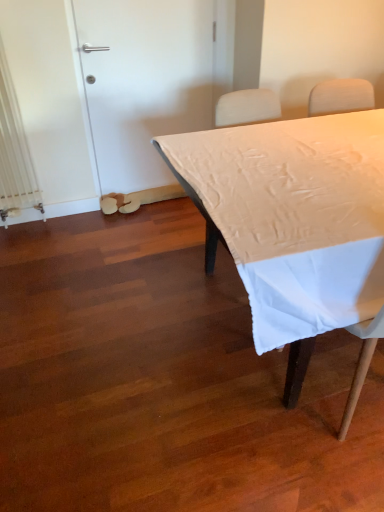
The width and height of the screenshot is (384, 512). What are the coordinates of `vacant space in front of white matte door at upper left` in the screenshot? It's located at 148,232.